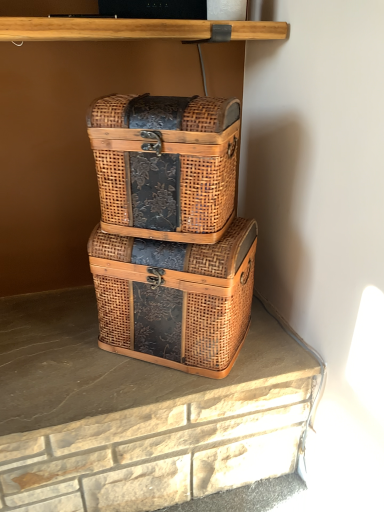
Question: In which direction should I rotate to look at woven wood box at center, the second box viewed from the top?

Choices:
 (A) left
 (B) right

Answer: (A)

Question: Can you confirm if woven wood box at center, the second box viewed from the top, is positioned to the left of woven wood box at center, which ranks as the 2th box in bottom-to-top order?

Choices:
 (A) no
 (B) yes

Answer: (A)

Question: Is woven wood box at center, which ranks as the 2th box in bottom-to-top order, located within woven wood box at center, the second box viewed from the top?

Choices:
 (A) yes
 (B) no

Answer: (B)

Question: Is woven wood box at center, the second box viewed from the top, far from woven wood box at center, which ranks as the 2th box in bottom-to-top order?

Choices:
 (A) yes
 (B) no

Answer: (B)

Question: Does woven wood box at center, which ranks as the 1th box in bottom-to-top order, come behind woven wood box at center, the first box from the top?

Choices:
 (A) no
 (B) yes

Answer: (B)

Question: From the image's perspective, is woven wood box at center, the second box viewed from the top, located above woven wood box at center, the first box from the top?

Choices:
 (A) yes
 (B) no

Answer: (B)

Question: Is woven wood box at center, which ranks as the 1th box in bottom-to-top order, smaller than woven wood box at center, which ranks as the 2th box in bottom-to-top order?

Choices:
 (A) no
 (B) yes

Answer: (A)

Question: Can you confirm if woven wood box at center, the first box from the top, is smaller than woven wood box at center, which ranks as the 1th box in bottom-to-top order?

Choices:
 (A) no
 (B) yes

Answer: (B)

Question: Considering the relative sizes of woven wood box at center, the first box from the top, and woven wood box at center, which ranks as the 1th box in bottom-to-top order, in the image provided, is woven wood box at center, the first box from the top, bigger than woven wood box at center, which ranks as the 1th box in bottom-to-top order,?

Choices:
 (A) no
 (B) yes

Answer: (A)

Question: From the image's perspective, is woven wood box at center, which ranks as the 2th box in bottom-to-top order, over woven wood box at center, which ranks as the 1th box in bottom-to-top order?

Choices:
 (A) yes
 (B) no

Answer: (A)

Question: Can you confirm if woven wood box at center, the first box from the top, is positioned to the left of woven wood box at center, which ranks as the 1th box in bottom-to-top order?

Choices:
 (A) yes
 (B) no

Answer: (A)

Question: From a real-world perspective, does woven wood box at center, the first box from the top, stand above woven wood box at center, which ranks as the 1th box in bottom-to-top order?

Choices:
 (A) no
 (B) yes

Answer: (B)

Question: Can you confirm if woven wood box at center, which ranks as the 2th box in bottom-to-top order, is shorter than woven wood box at center, which ranks as the 1th box in bottom-to-top order?

Choices:
 (A) yes
 (B) no

Answer: (A)

Question: From the image's perspective, is woven wood box at center, the first box from the top, above or below woven wood box at center, which ranks as the 1th box in bottom-to-top order?

Choices:
 (A) above
 (B) below

Answer: (A)